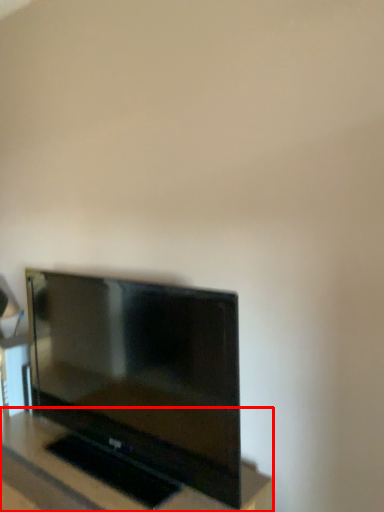
Question: From the image's perspective, where is furniture (annotated by the red box) located in relation to television in the image?

Choices:
 (A) below
 (B) above

Answer: (A)